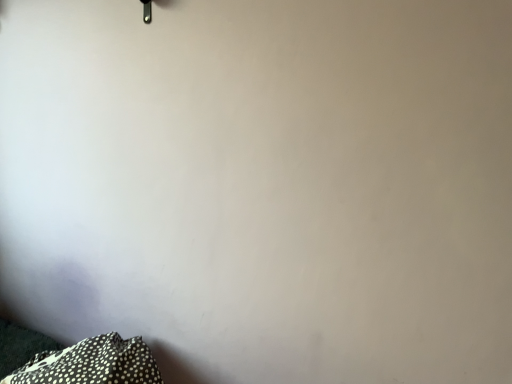
The image size is (512, 384). What do you see at coordinates (91, 364) in the screenshot?
I see `white dotted fabric at lower left` at bounding box center [91, 364].

Locate an element on the screen. Image resolution: width=512 pixels, height=384 pixels. white dotted fabric at lower left is located at coordinates (91, 364).

In order to face white dotted fabric at lower left, should I rotate leftwards or rightwards?

To face it directly, rotate left by 19.651 degrees.

Measure the distance between white dotted fabric at lower left and camera.

A distance of 1.07 meters exists between white dotted fabric at lower left and camera.

Identify the location of white dotted fabric at lower left. (91, 364).